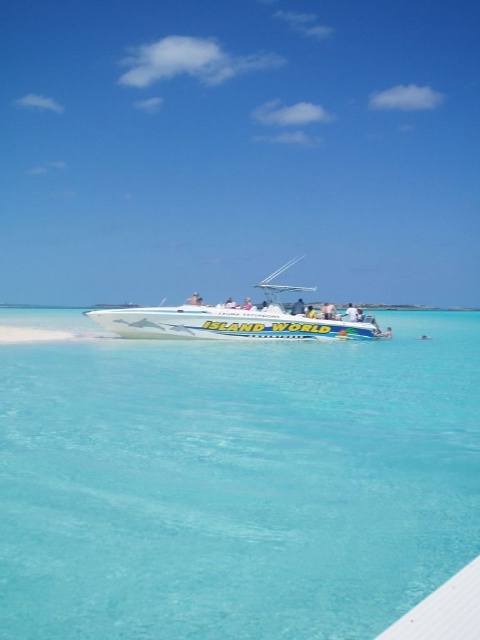
Question: Among these points, which one is nearest to the camera?

Choices:
 (A) (266, 276)
 (B) (55, 595)

Answer: (B)

Question: Can you confirm if clear blue water at center is positioned to the left of white glossy speedboat at center?

Choices:
 (A) yes
 (B) no

Answer: (A)

Question: Does clear blue water at center appear over white glossy speedboat at center?

Choices:
 (A) no
 (B) yes

Answer: (A)

Question: Among these objects, which one is nearest to the camera?

Choices:
 (A) clear blue water at center
 (B) white glossy speedboat at center

Answer: (A)

Question: Is clear blue water at center closer to the viewer compared to white glossy speedboat at center?

Choices:
 (A) no
 (B) yes

Answer: (B)